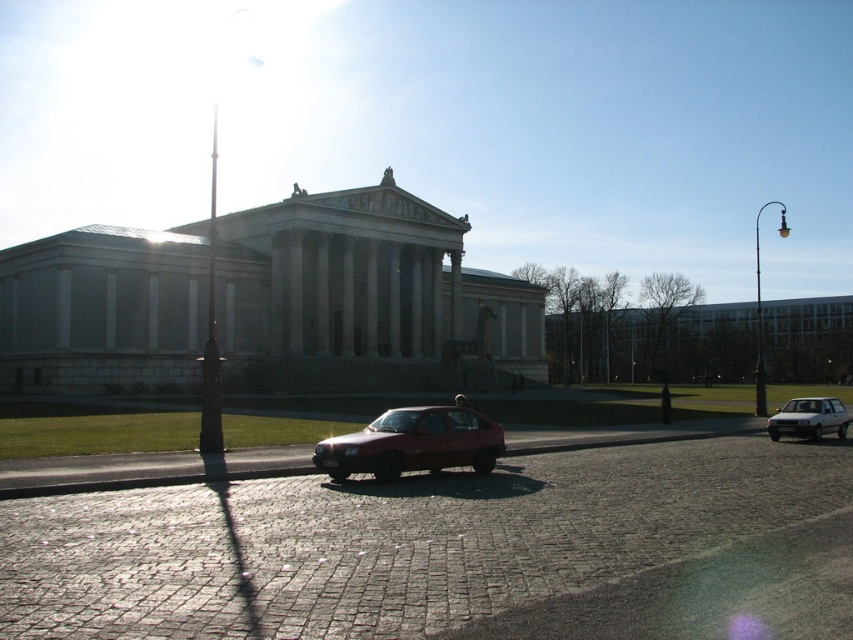
Question: Which of the following is the farthest from the observer?

Choices:
 (A) (444, 461)
 (B) (846, 416)

Answer: (B)

Question: Can you confirm if matte red car at center is positioned to the left of silver metallic hatchback at right?

Choices:
 (A) yes
 (B) no

Answer: (A)

Question: Is matte red car at center to the right of silver metallic hatchback at right from the viewer's perspective?

Choices:
 (A) no
 (B) yes

Answer: (A)

Question: Among these objects, which one is farthest from the camera?

Choices:
 (A) matte red car at center
 (B) silver metallic hatchback at right

Answer: (B)

Question: Is matte red car at center closer to camera compared to silver metallic hatchback at right?

Choices:
 (A) no
 (B) yes

Answer: (B)